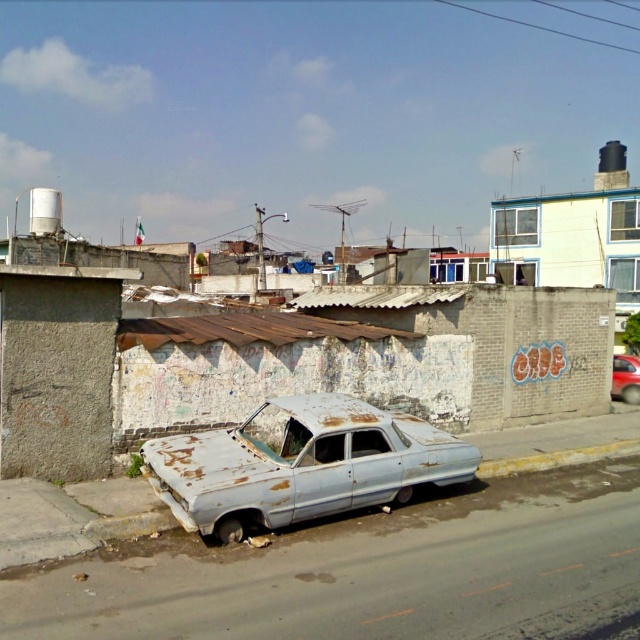
You are a delivery person who needs to park your delivery van between the rusty metal car at center and the shiny red car at right. The van is 20 feet long. Can you fit your van between them without overlapping either car?

The rusty metal car at center is 46.05 feet from the shiny red car at right. Since the van is only 20 feet long, there is enough space between them to park the van without overlapping either car.